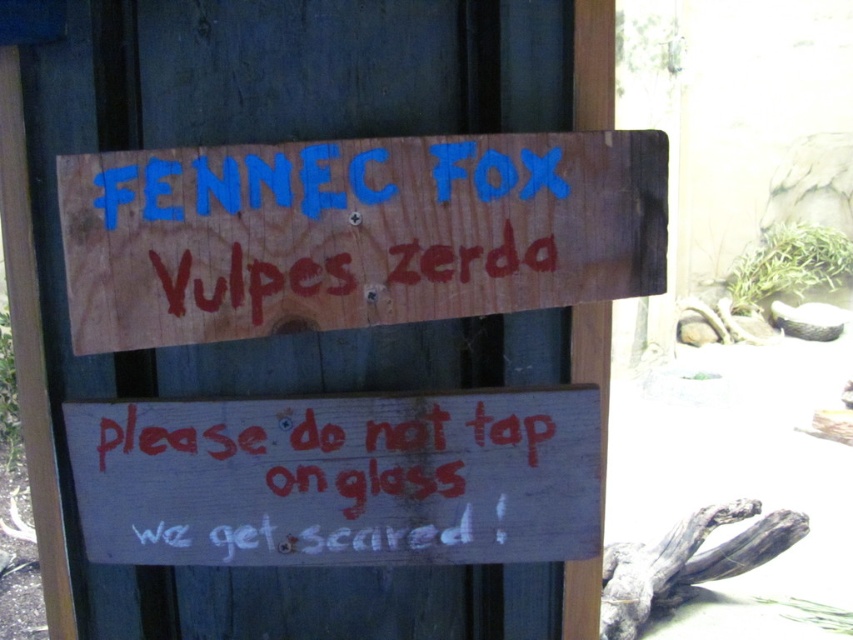
You are standing in front of the wooden frame with two signs. Which sign, the wooden signboard at upper center or the white painted wood sign at lower center, is nearer to you?

The wooden signboard at upper center is closer to the viewer than the white painted wood sign at lower center.

You are standing in front of the wooden signboard at upper center. If you want to read the lower sign, should you look up or down?

The wooden signboard at upper center is located at point (355, 232). Since the lower sign is below it, you should look down to read the lower sign.

You are a zoo visitor looking at the wooden signboard at upper center and the white painted wood sign at lower center. Which one is positioned more to the right side?

The wooden signboard at upper center is positioned more to the right side than the white painted wood sign at lower center.